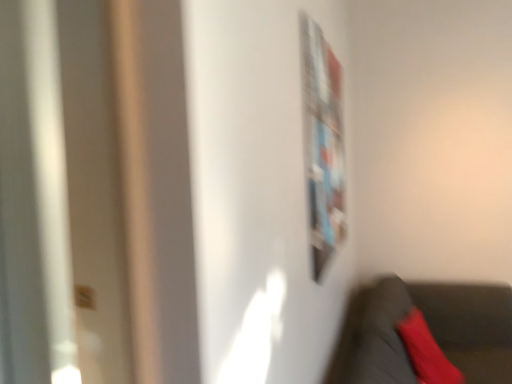
Question: From the image's perspective, does velvet black chair at lower right appear higher than metallic silver bulletin board at upper right?

Choices:
 (A) no
 (B) yes

Answer: (A)

Question: Considering the relative sizes of velvet black chair at lower right and metallic silver bulletin board at upper right in the image provided, is velvet black chair at lower right smaller than metallic silver bulletin board at upper right?

Choices:
 (A) yes
 (B) no

Answer: (B)

Question: From the image's perspective, is velvet black chair at lower right below metallic silver bulletin board at upper right?

Choices:
 (A) yes
 (B) no

Answer: (A)

Question: Can we say velvet black chair at lower right lies outside metallic silver bulletin board at upper right?

Choices:
 (A) yes
 (B) no

Answer: (A)

Question: Can you confirm if velvet black chair at lower right is wider than metallic silver bulletin board at upper right?

Choices:
 (A) no
 (B) yes

Answer: (B)

Question: Is velvet black chair at lower right shorter than metallic silver bulletin board at upper right?

Choices:
 (A) yes
 (B) no

Answer: (A)

Question: From a real-world perspective, is metallic silver bulletin board at upper right under velvet red pillow at lower right?

Choices:
 (A) yes
 (B) no

Answer: (B)

Question: Does metallic silver bulletin board at upper right have a greater height compared to velvet red pillow at lower right?

Choices:
 (A) yes
 (B) no

Answer: (A)

Question: Is metallic silver bulletin board at upper right bigger than velvet red pillow at lower right?

Choices:
 (A) yes
 (B) no

Answer: (B)

Question: Can you confirm if metallic silver bulletin board at upper right is thinner than velvet red pillow at lower right?

Choices:
 (A) no
 (B) yes

Answer: (B)

Question: Can you confirm if metallic silver bulletin board at upper right is wider than velvet red pillow at lower right?

Choices:
 (A) yes
 (B) no

Answer: (B)

Question: Could you tell me if metallic silver bulletin board at upper right is turned towards velvet red pillow at lower right?

Choices:
 (A) no
 (B) yes

Answer: (A)

Question: Is metallic silver bulletin board at upper right located within velvet red pillow at lower right?

Choices:
 (A) yes
 (B) no

Answer: (B)